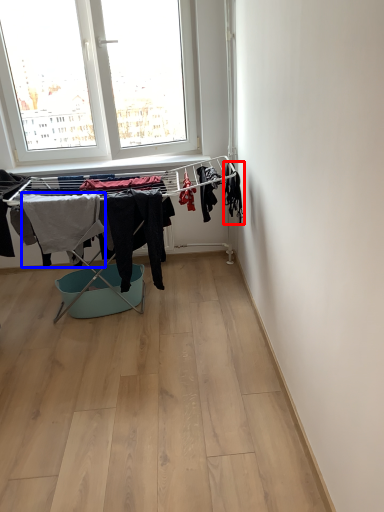
Question: Which point is further to the camera, clothing (highlighted by a red box) or clothing (highlighted by a blue box)?

Choices:
 (A) clothing
 (B) clothing

Answer: (B)